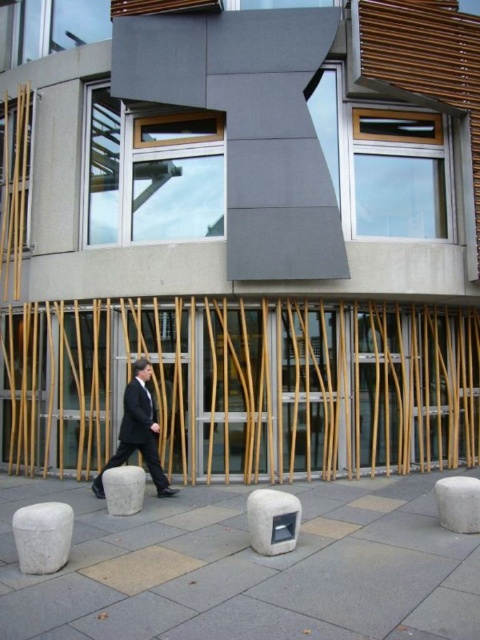
Describe the element at coordinates (123, 490) in the screenshot. I see `white stone stool at lower center` at that location.

Who is higher up, white stone stool at lower center or black silk tie at center?

Positioned higher is black silk tie at center.

Which is in front, point (129, 467) or point (148, 394)?

Positioned in front is point (129, 467).

Image resolution: width=480 pixels, height=640 pixels. Find the location of `white stone stool at lower center`. white stone stool at lower center is located at coordinates (123, 490).

Is white stone speaker at center positioned behind gray concrete stool at lower center?

No, it is not.

This screenshot has height=640, width=480. In order to click on white stone speaker at center in this screenshot , I will do click(x=247, y=566).

Who is positioned more to the right, white stone stool at lower left or white stone stool at lower center?

white stone stool at lower center

Find the location of a particular element. white stone stool at lower left is located at coordinates (43, 536).